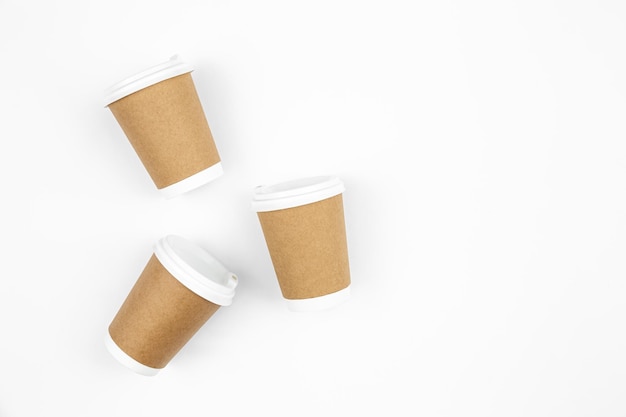
At what (x,y) coordinates should I click in order to perform the action: click on white areas of cups. Please return your answer as a coordinate pair (x, y). The height and width of the screenshot is (417, 626). Looking at the image, I should click on (320, 301), (300, 198), (211, 288), (124, 356), (208, 175), (149, 77).